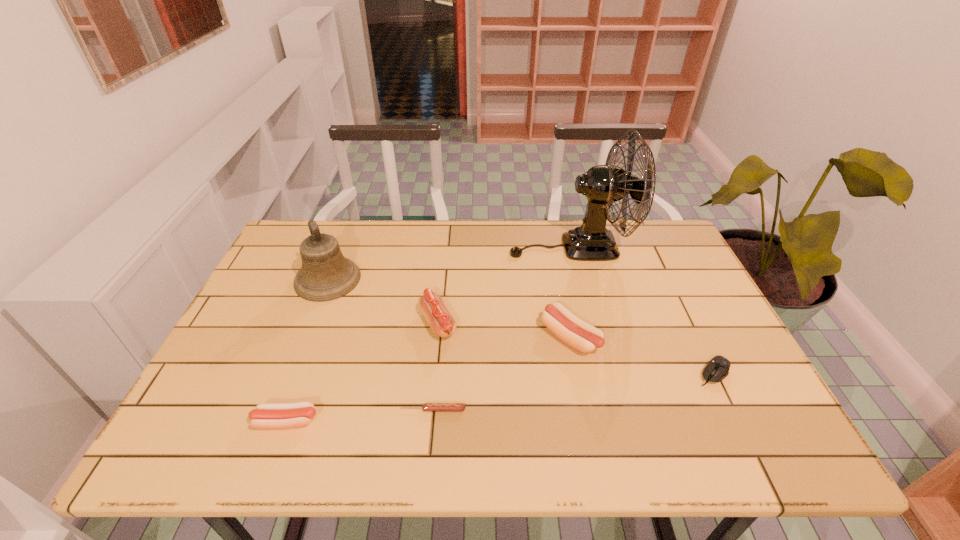
I want to click on free space located 0.340m in front of the tallest object, indicating the direction of air flow, so click(x=401, y=247).

Find the location of `free space located on the front of the bell`. free space located on the front of the bell is located at coordinates (299, 354).

Locate an element on the screen. vacant space located 0.340m on the left of the rightmost sausage is located at coordinates (407, 337).

Where is `blank area located 0.110m on the back of the third tallest sausage`? Image resolution: width=960 pixels, height=540 pixels. blank area located 0.110m on the back of the third tallest sausage is located at coordinates (305, 368).

Identify the location of free location located 0.140m on the left of the computer mouse. This screenshot has width=960, height=540. (635, 373).

Find the location of a particular element. This screenshot has width=960, height=540. vacant space located on the back of the shortest sausage is located at coordinates (444, 293).

The height and width of the screenshot is (540, 960). Identify the location of fan that is at the far edge. (603, 185).

Identify the location of bell located at the far edge. This screenshot has height=540, width=960. tap(325, 275).

At what (x,y) coordinates should I click in order to perform the action: click on object that is positioned at the near edge. Please return your answer as a coordinate pair (x, y). Image resolution: width=960 pixels, height=540 pixels. Looking at the image, I should click on (266, 415).

This screenshot has height=540, width=960. What are the coordinates of `bell located at the left edge` in the screenshot? It's located at (325, 275).